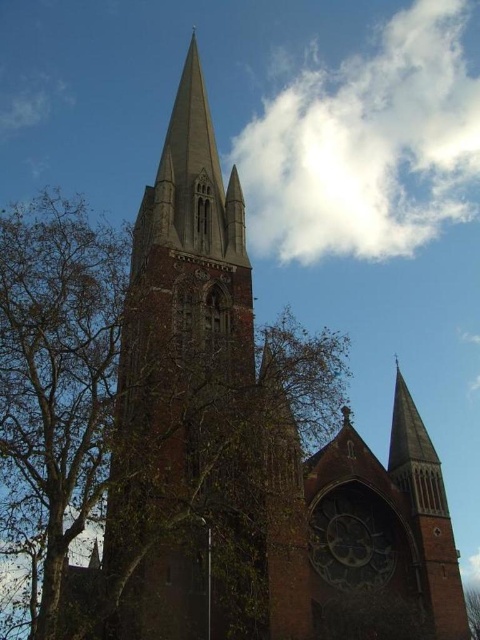
You are standing in front of the grand church and want to take a photo of the red brick church steeple at center. If your camera can focus on objects up to 150 feet away, will you be able to capture a clear image of the steeple?

The red brick church steeple at center is 154.19 feet away from the camera, which exceeds the camera focus limit of 150 feet. Therefore, the camera cannot focus clearly on the steeple.

You are standing in front of the grand church and want to compare the sizes of the objects around you. Which object, the brown textured tree at left or the dark brown wooden clock at center, is larger?

The brown textured tree at left is bigger than the dark brown wooden clock at center.